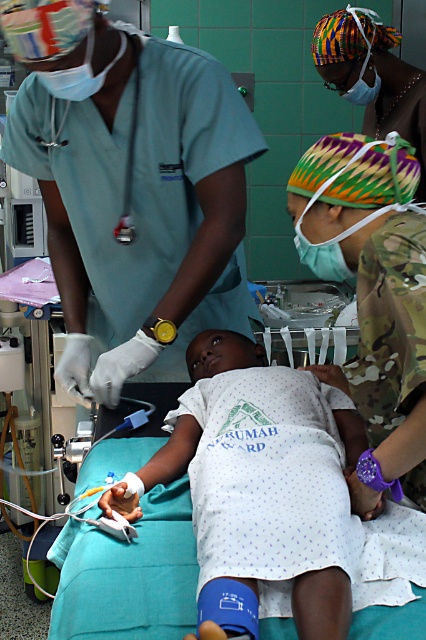
Between white dotted fabric at center and multicolored woven headwrap at upper right, which one has more height?

multicolored woven headwrap at upper right

Which of these two, white dotted fabric at center or multicolored woven headwrap at upper right, stands shorter?

white dotted fabric at center

Is point (319, 625) less distant than point (348, 29)?

Yes.

Locate an element on the screen. white dotted fabric at center is located at coordinates (322, 605).

Which is below, camouflage fabric soldier at center or white dotted fabric at center?

white dotted fabric at center is below.

Is point (80, 189) farther from viewer compared to point (204, 330)?

No, (80, 189) is in front of (204, 330).

Locate an element on the screen. The width and height of the screenshot is (426, 640). camouflage fabric soldier at center is located at coordinates (132, 188).

Which of these two, camouflage fabric soldier at center or multicolored woven headwrap at upper right, stands taller?

With more height is camouflage fabric soldier at center.

Which is behind, point (140, 316) or point (383, 24)?

The point (383, 24) is more distant.

Does point (172, 58) come farther from viewer compared to point (402, 64)?

No, (172, 58) is closer to viewer.

Locate an element on the screen. This screenshot has width=426, height=640. camouflage fabric soldier at center is located at coordinates (132, 188).